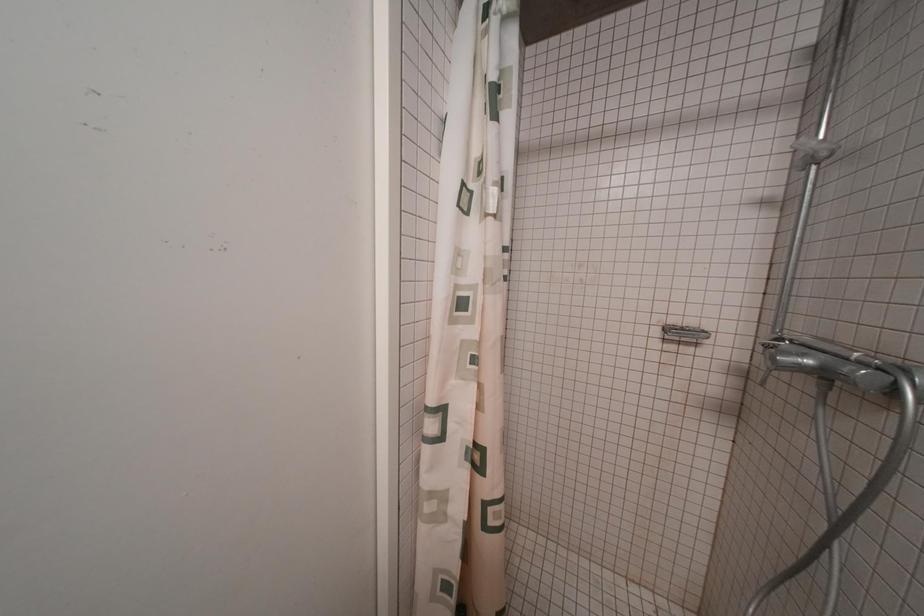
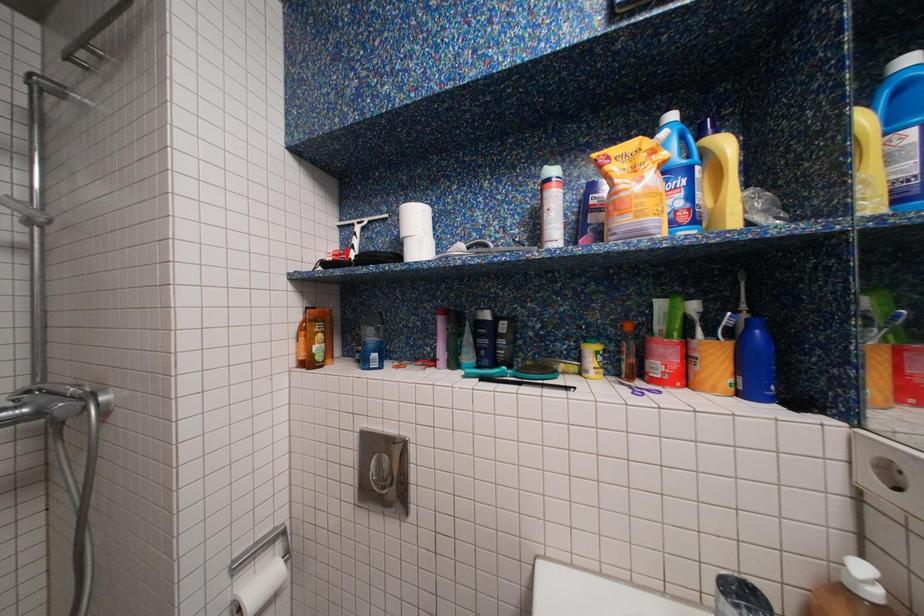
Question: The camera is either moving clockwise (left) or counter-clockwise (right) around the object. The first image is from the beginning of the video and the second image is from the end. Is the camera moving left or right when shooting the video?

Choices:
 (A) Left
 (B) Right

Answer: (A)